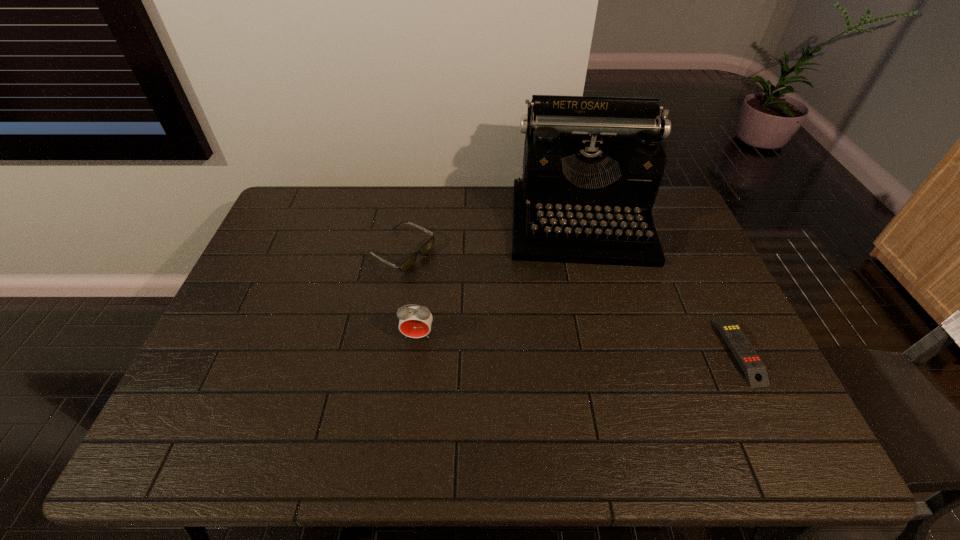
Locate an element on the screen. vacant space in between the tallest object and the alarm clock is located at coordinates pos(499,279).

The height and width of the screenshot is (540, 960). In order to click on vacant area that lies between the typewriter and the shortest object in this screenshot , I will do `click(660, 287)`.

The height and width of the screenshot is (540, 960). In order to click on vacant point located between the alarm clock and the remote control in this screenshot , I will do `click(578, 343)`.

Find the location of a particular element. This screenshot has height=540, width=960. free spot between the remote control and the alarm clock is located at coordinates (578, 343).

Find the location of `the third closest object to the third shortest object`. the third closest object to the third shortest object is located at coordinates (754, 369).

At what (x,y) coordinates should I click in order to perform the action: click on object identified as the closest to the second shortest object. Please return your answer as a coordinate pair (x, y). Looking at the image, I should click on (415, 321).

Locate an element on the screen. The image size is (960, 540). vacant region that satisfies the following two spatial constraints: 1. on the front side of the remote control; 2. on the right side of the second object from right to left is located at coordinates (613, 351).

Identify the location of vacant region that satisfies the following two spatial constraints: 1. on the face of the rightmost object; 2. on the right side of the second tallest object. The width and height of the screenshot is (960, 540). (416, 351).